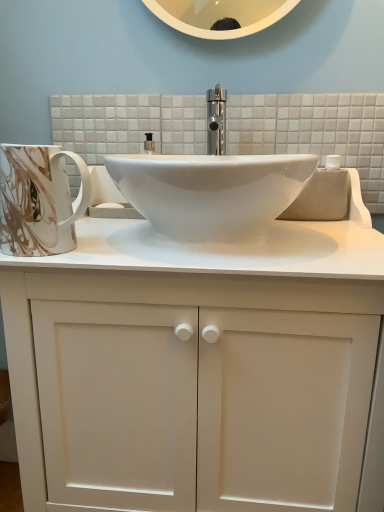
Question: Is point (223, 480) closer or farther from the camera than point (54, 250)?

Choices:
 (A) closer
 (B) farther

Answer: (B)

Question: Is white matte cabinet at center taller or shorter than marble-patterned ceramic mug at left?

Choices:
 (A) tall
 (B) short

Answer: (A)

Question: From the image's perspective, is white matte cabinet at center positioned above or below marble-patterned ceramic mug at left?

Choices:
 (A) below
 (B) above

Answer: (A)

Question: From the image's perspective, is marble-patterned ceramic mug at left positioned above or below white matte cabinet at center?

Choices:
 (A) below
 (B) above

Answer: (B)

Question: Considering the positions of marble-patterned ceramic mug at left and white matte cabinet at center in the image, is marble-patterned ceramic mug at left wider or thinner than white matte cabinet at center?

Choices:
 (A) wide
 (B) thin

Answer: (B)

Question: From a real-world perspective, is marble-patterned ceramic mug at left physically located above or below white matte cabinet at center?

Choices:
 (A) above
 (B) below

Answer: (A)

Question: Is point (51, 167) closer or farther from the camera than point (235, 476)?

Choices:
 (A) farther
 (B) closer

Answer: (B)